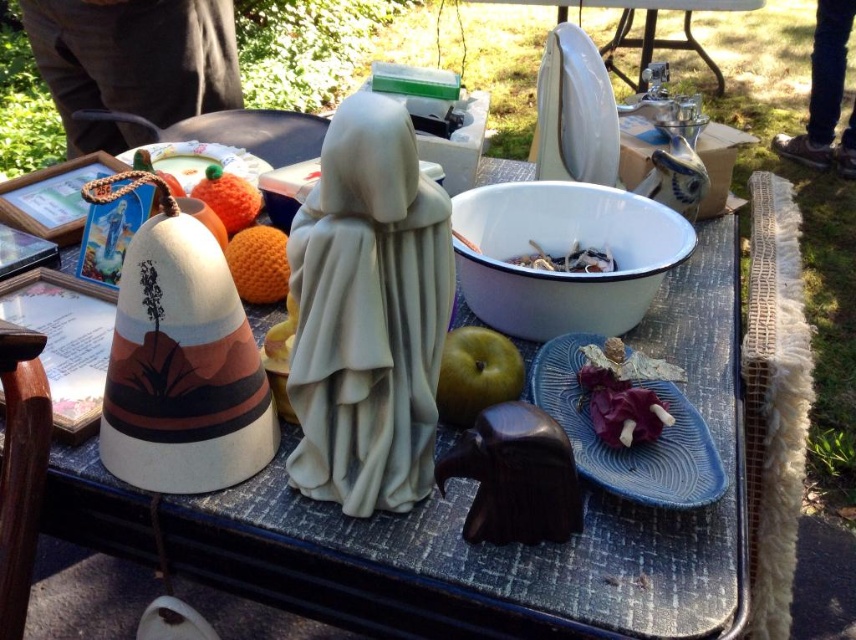
Does matte blue platter at center right have a lesser width compared to green matte apple at center?

Incorrect, matte blue platter at center right's width is not less than green matte apple at center's.

Is matte blue platter at center right taller than green matte apple at center?

Yes, matte blue platter at center right is taller than green matte apple at center.

This screenshot has width=856, height=640. Describe the element at coordinates (632, 448) in the screenshot. I see `matte blue platter at center right` at that location.

Locate an element on the screen. This screenshot has width=856, height=640. matte blue platter at center right is located at coordinates (632, 448).

Is white matte statue at center taller than orange fuzzy ball at upper center?

Yes.

Identify the location of white matte statue at center. (367, 314).

The height and width of the screenshot is (640, 856). I want to click on white matte statue at center, so click(367, 314).

Between point (651, 493) and point (545, 262), which one is positioned behind?

The point (545, 262) is behind.

The image size is (856, 640). Describe the element at coordinates (632, 448) in the screenshot. I see `matte blue platter at center right` at that location.

Where is `matte blue platter at center right`? This screenshot has width=856, height=640. matte blue platter at center right is located at coordinates (632, 448).